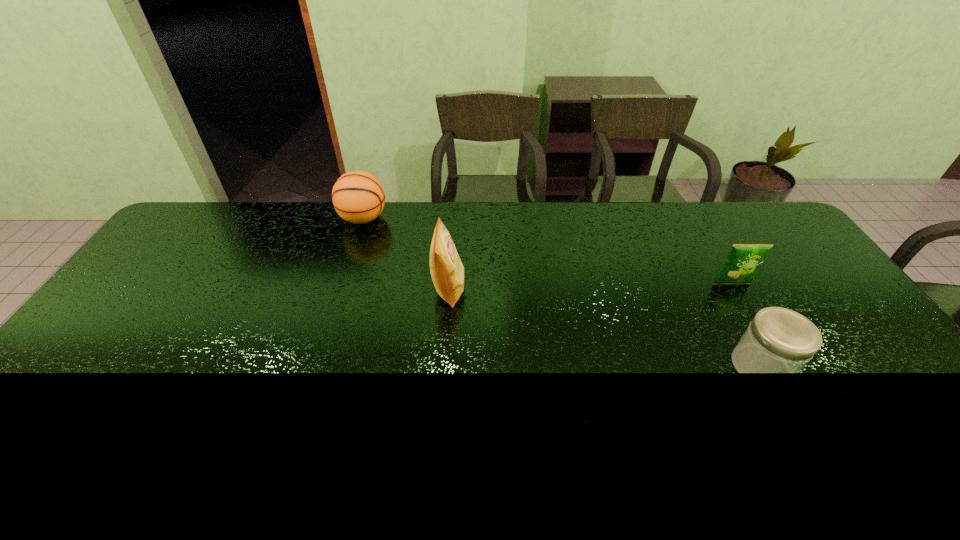
Find the location of a particular element. This screenshot has width=960, height=540. object located in the far edge section of the desktop is located at coordinates (358, 197).

At what (x,y) coordinates should I click in order to perform the action: click on vacant space at the far edge of the desktop. Please return your answer as a coordinate pair (x, y). Looking at the image, I should click on (685, 203).

Where is `vacant region at the near edge of the desktop`? This screenshot has height=540, width=960. vacant region at the near edge of the desktop is located at coordinates (842, 459).

The image size is (960, 540). In the image, there is a desktop. What are the coordinates of `vacant region at the left edge` in the screenshot? It's located at (185, 282).

In the image, there is a desktop. Where is `vacant space at the right edge`? vacant space at the right edge is located at coordinates (893, 369).

Where is `vacant space at the far left corner of the desktop`? This screenshot has height=540, width=960. vacant space at the far left corner of the desktop is located at coordinates (222, 202).

Where is `free region at the near left corner`? free region at the near left corner is located at coordinates (58, 463).

Identify the location of free space between the leftmost object and the right crisp (potato chip). (547, 251).

Identify the location of vacant region between the left crisp (potato chip) and the basketball. (406, 254).

Where is `empty location between the shorter crisp (potato chip) and the left crisp (potato chip)`? The width and height of the screenshot is (960, 540). empty location between the shorter crisp (potato chip) and the left crisp (potato chip) is located at coordinates (590, 287).